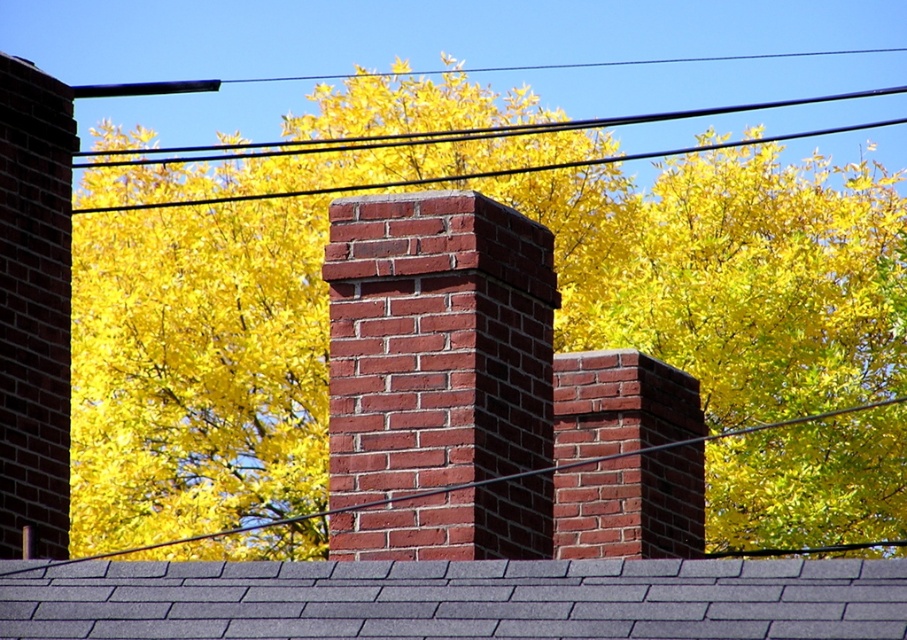
Does red brick chimney at center appear on the left side of black wire at upper center?

No, red brick chimney at center is not to the left of black wire at upper center.

Does red brick chimney at center appear under black wire at upper center?

Correct, red brick chimney at center is located below black wire at upper center.

Based on the photo, who is more forward, (411, 336) or (285, 154)?

Point (411, 336) is more forward.

Identify the location of red brick chimney at center. (436, 342).

Based on the photo, which is below, yellow leafy tree at upper center or gray shingles at center?

gray shingles at center

Who is more distant from viewer, (216, 406) or (658, 600)?

Point (216, 406)

Is point (299, 429) farther from camera compared to point (852, 618)?

Yes, it is behind point (852, 618).

Identify the location of yellow leafy tree at upper center. (554, 320).

Between gray shingles at center and black wire at upper center, which one has less height?

With less height is gray shingles at center.

Does gray shingles at center appear on the left side of black wire at upper center?

No, gray shingles at center is not to the left of black wire at upper center.

Find the location of a particular element. gray shingles at center is located at coordinates (460, 598).